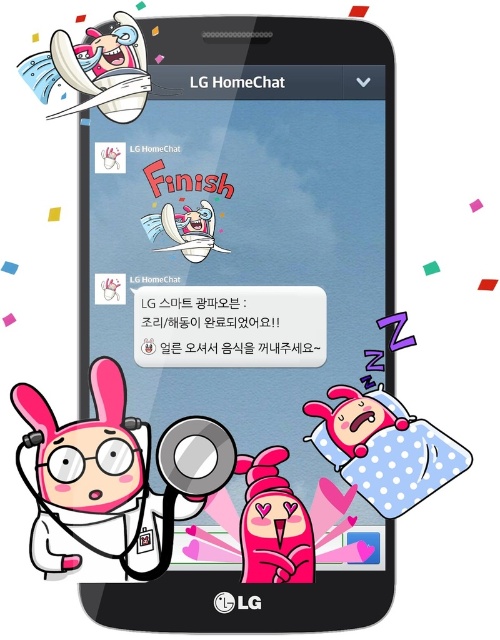
Who is shorter, matte white surfboard at upper left or white glossy rabbit at center?

white glossy rabbit at center

Looking at this image, measure the distance between point (79, 108) and camera.

Point (79, 108) and camera are 20.96 inches apart.

I want to click on matte white surfboard at upper left, so click(95, 68).

Which is more to the right, white glossy rabbit at center or black plastic text at upper center?

black plastic text at upper center is more to the right.

Describe the element at coordinates (185, 228) in the screenshot. I see `white glossy rabbit at center` at that location.

Find the location of a particular element. Image resolution: width=500 pixels, height=640 pixels. white glossy rabbit at center is located at coordinates (185, 228).

Between polka dot fabric pillow at lower right and black plastic text at upper center, which one has more height?

polka dot fabric pillow at lower right is taller.

Consider the image. Who is positioned more to the right, polka dot fabric pillow at lower right or black plastic text at upper center?

Result: polka dot fabric pillow at lower right is more to the right.

Find the location of a particular element. The height and width of the screenshot is (640, 500). polka dot fabric pillow at lower right is located at coordinates (384, 449).

Where is `polka dot fabric pillow at lower right`? The height and width of the screenshot is (640, 500). polka dot fabric pillow at lower right is located at coordinates (384, 449).